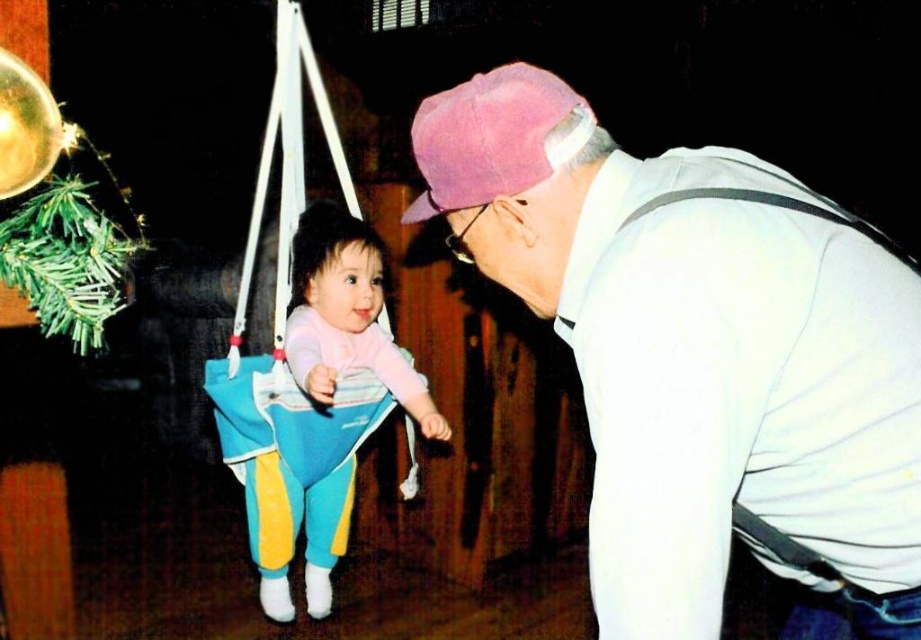
You are an observer looking at the scene. The older man is wearing a pink baseball cap. Can you tell me the position of the white cotton shirt at upper right relative to the pink fabric baseball cap at upper center?

The white cotton shirt at upper right is below the pink fabric baseball cap at upper center.

You are a photographer trying to capture the perfect shot of the scene. You notice the white cotton shirt at upper right and the pastel pink fabric baby swing at center. Which object should you focus on first if you want to ensure both are in frame without moving the camera? Explain your reasoning based on their sizes.

The white cotton shirt at upper right has a lesser width compared to the pastel pink fabric baby swing at center. Since the swing is wider, focusing on it first ensures that the narrower shirt will still fit within the frame when centered. Alternatively, centering the swing and adjusting the zoom to include its width will naturally accommodate the smaller shirt in the composition.